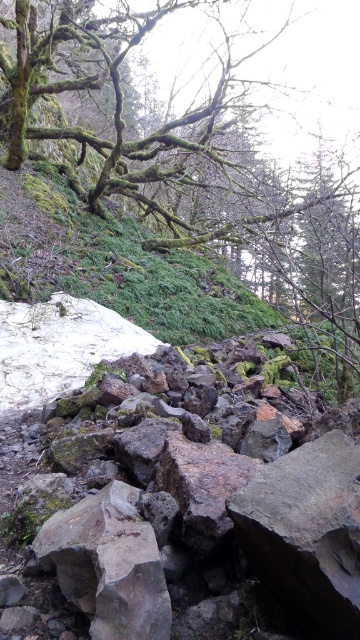
Question: Can you confirm if gray rough rocks at lower center is positioned above green mossy branch at upper left?

Choices:
 (A) yes
 (B) no

Answer: (B)

Question: Is gray rough rocks at lower center smaller than green mossy branch at upper left?

Choices:
 (A) yes
 (B) no

Answer: (A)

Question: Which point is closer to the camera?

Choices:
 (A) gray rough rock at center
 (B) gray rough rocks at lower center

Answer: (B)

Question: Which object is farther from the camera taking this photo?

Choices:
 (A) gray rough rocks at lower center
 (B) green mossy branch at upper left
 (C) gray rough rock at center

Answer: (B)

Question: Among these objects, which one is farthest from the camera?

Choices:
 (A) gray rough rock at center
 (B) green mossy branch at upper left

Answer: (B)

Question: Does gray rough rocks at lower center appear on the left side of green mossy branch at upper left?

Choices:
 (A) no
 (B) yes

Answer: (B)